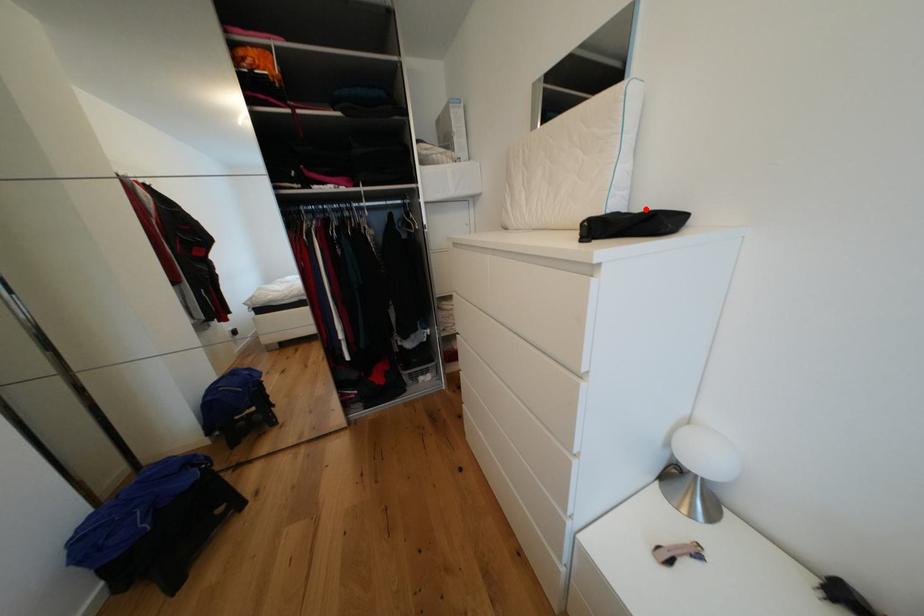
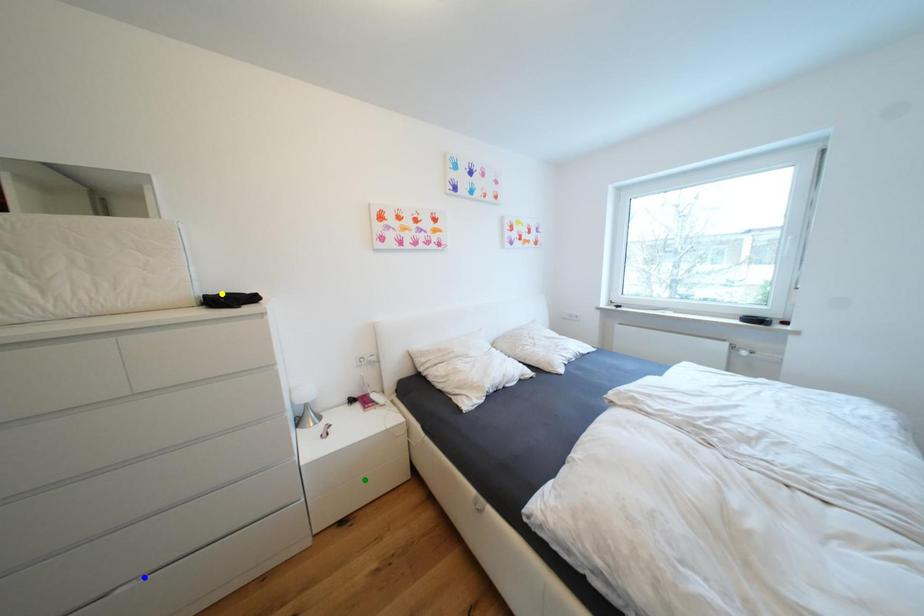
Question: I am providing you with two images of the same scene from different viewpoints. A red point is marked on the first image. You are given multiple points on the second image. Which spot in image 2 lines up with the point in image 1?

Choices:
 (A) blue point
 (B) green point
 (C) yellow point

Answer: (C)